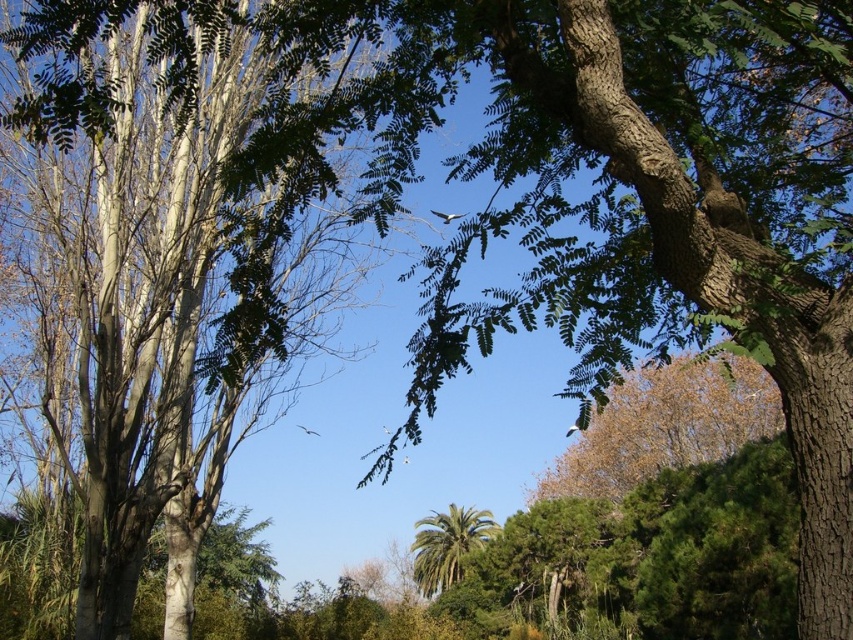
Can you confirm if green leafy tree at center is taller than brown leafy tree at upper center?

Incorrect, green leafy tree at center's height is not larger of brown leafy tree at upper center's.

Is point (86, 320) positioned after point (772, 416)?

No, it is not.

Which is behind, point (288, 304) or point (718, 449)?

The point (718, 449) is behind.

You are a GUI agent. You are given a task and a screenshot of the screen. Output one action in this format:
    pyautogui.click(x=<x>, y=<y>)
    Task: Click on the green leafy tree at center
    
    Given the screenshot: What is the action you would take?
    pyautogui.click(x=184, y=244)

Describe the element at coordinates (665, 426) in the screenshot. I see `brown leafy tree at upper center` at that location.

Consider the image. Who is more forward, (720, 408) or (437, 579)?

Point (720, 408) is more forward.

Does point (659, 384) come behind point (415, 548)?

That is False.

Locate an element on the screen. This screenshot has width=853, height=640. brown leafy tree at upper center is located at coordinates (665, 426).

Can you confirm if green leafy tree at center is positioned to the left of green leafy palm at center?

Correct, you'll find green leafy tree at center to the left of green leafy palm at center.

Does green leafy tree at center come behind green leafy palm at center?

That is False.

The width and height of the screenshot is (853, 640). Describe the element at coordinates (184, 244) in the screenshot. I see `green leafy tree at center` at that location.

You are a GUI agent. You are given a task and a screenshot of the screen. Output one action in this format:
    pyautogui.click(x=<x>, y=<y>)
    Task: Click on the green leafy tree at center
    The image size is (853, 640).
    Given the screenshot: What is the action you would take?
    pyautogui.click(x=184, y=244)